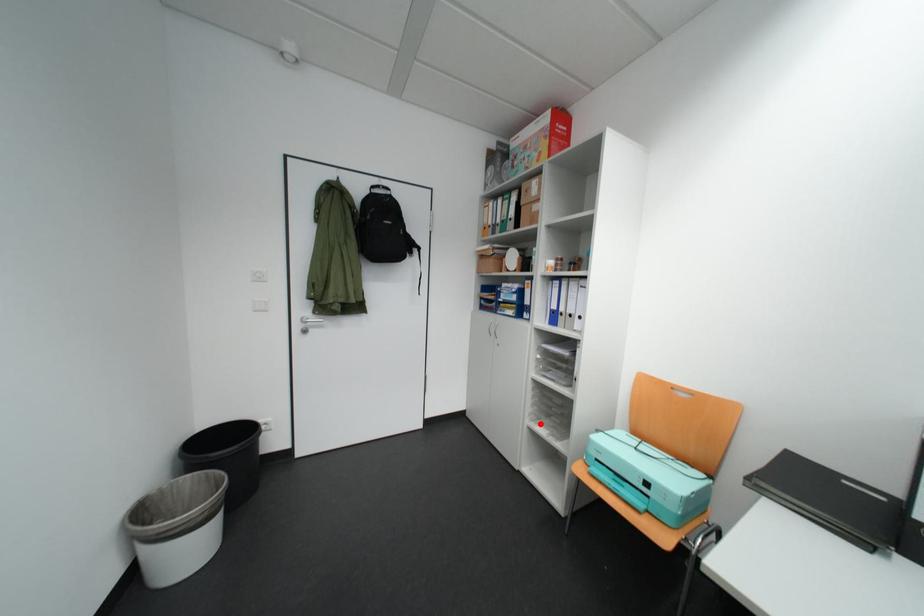
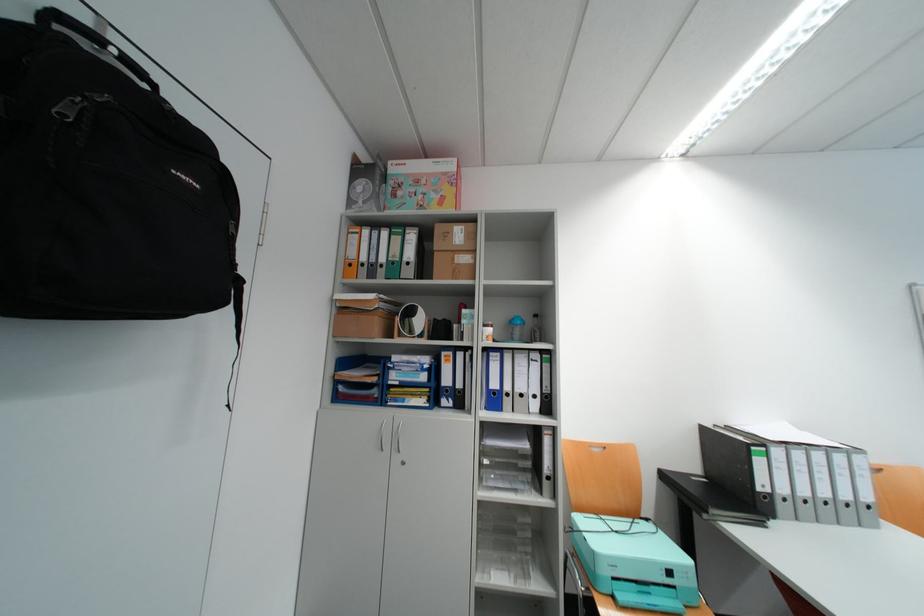
The point at the highlighted location is marked in the first image. Where is the corresponding point in the second image?

(491, 581)